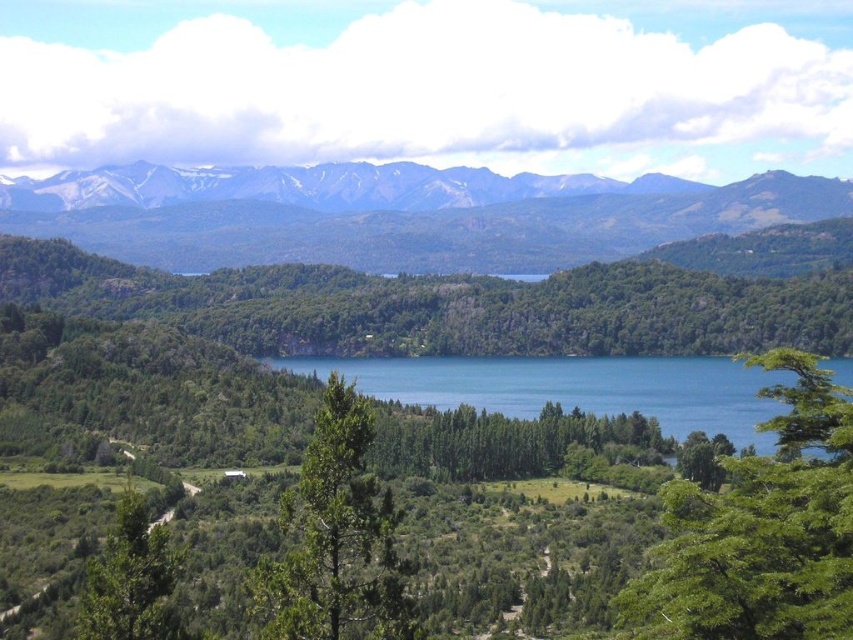
You are a hiker planning to take a photo of the green leafy tree at center and the sandy brown mountains at upper center. Which object will appear bigger in your photo?

The green leafy tree at center will appear bigger in the photo because it is larger in size than the sandy brown mountains at upper center.

You are planning to take a photo of the sandy brown mountains at upper center and the green leafy tree at lower left. Which object should you focus on first if you want to capture both in a single frame without moving the camera?

You should focus on the sandy brown mountains at upper center first because they are wider than the green leafy tree at lower left, so they will occupy more space in the frame.